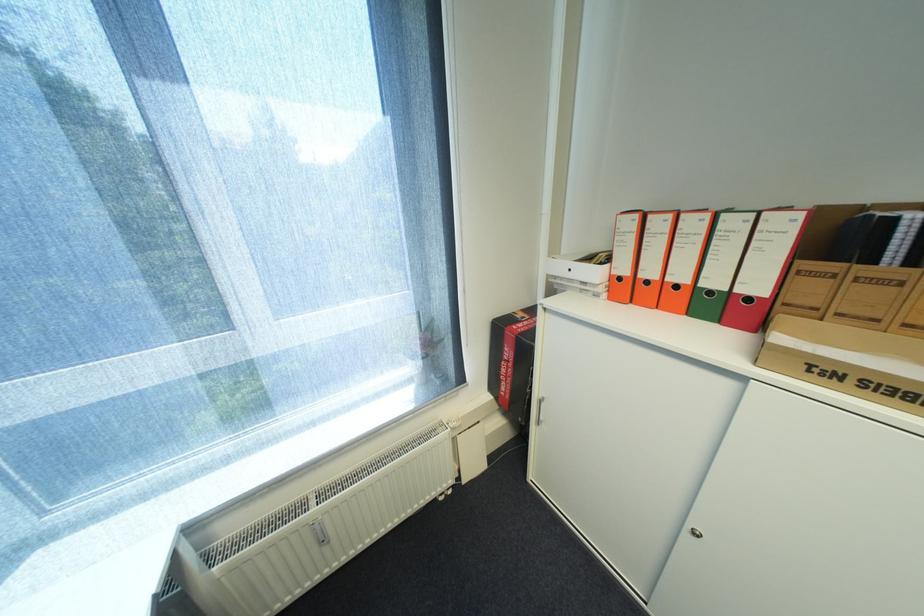
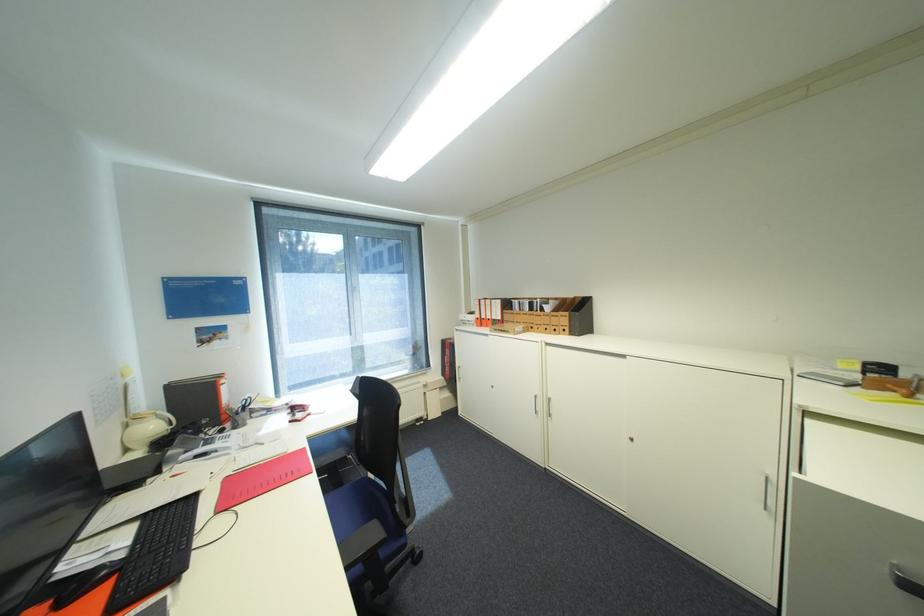
In the second image, find the point that corresponds to [604,275] in the first image.

(480, 318)